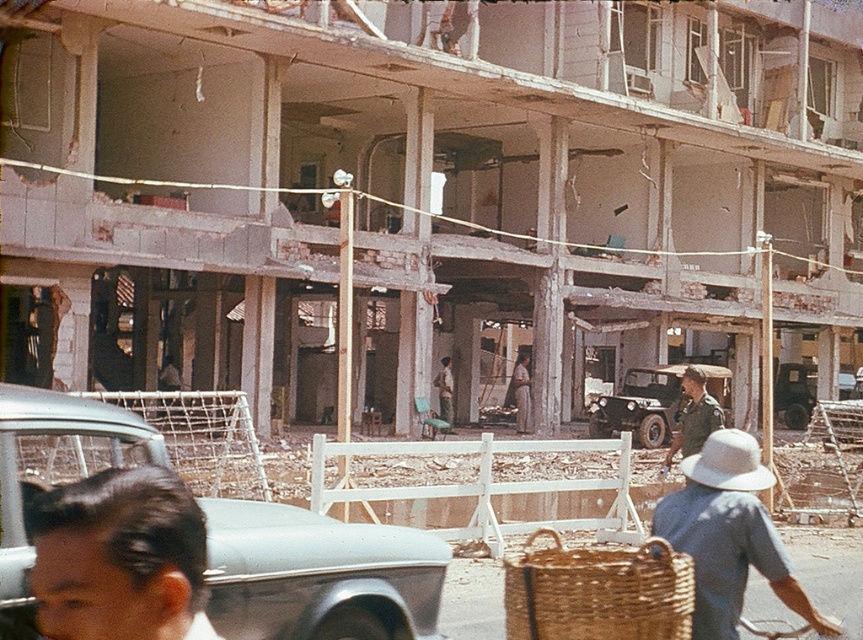
You are a delivery person needing to reach the green matte jeep at center. There is a woven brown basket at lower center in your path. Can you walk around it without stepping on the basket?

The woven brown basket at lower center is closer to the viewer than the green matte jeep at center, so you can walk around it to reach the green matte jeep at center without stepping on the basket.